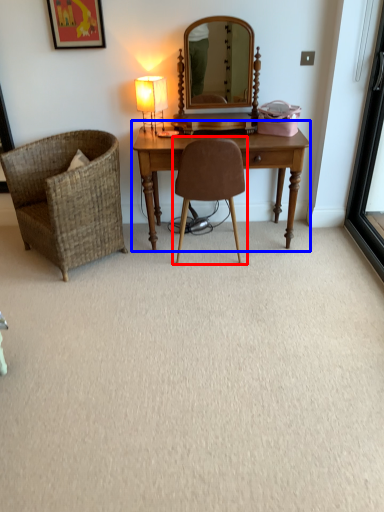
Question: Which object is further to the camera taking this photo, chair (highlighted by a red box) or table (highlighted by a blue box)?

Choices:
 (A) chair
 (B) table

Answer: (B)